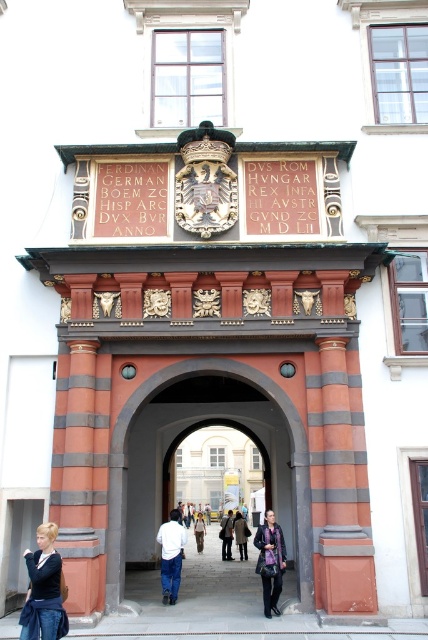
You are standing in front of the historical gateway and notice a terracotta brick pillar at right and a dark brown leather jacket at center. Which object is nearer to you?

The terracotta brick pillar at right is closer to the viewer than the dark brown leather jacket at center.

You are standing in front of the historical gateway and want to locate two specific points marked on the image. The first point is at coordinates point (353,572) and the second is at point (195,538). Which of these points is closer to you?

Point (353,572) is in front of point (195,538), so it is closer to you.